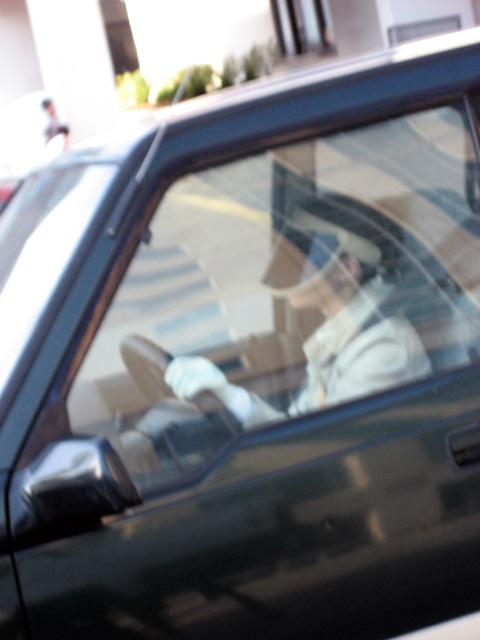
Can you confirm if white matte jacket at center is positioned below transparent glass window at upper center?

Yes, white matte jacket at center is below transparent glass window at upper center.

Can you confirm if white matte jacket at center is smaller than transparent glass window at upper center?

Indeed, white matte jacket at center has a smaller size compared to transparent glass window at upper center.

Is point (322, 248) positioned before point (307, 12)?

Yes.

Where is `white matte jacket at center`? white matte jacket at center is located at coordinates (322, 324).